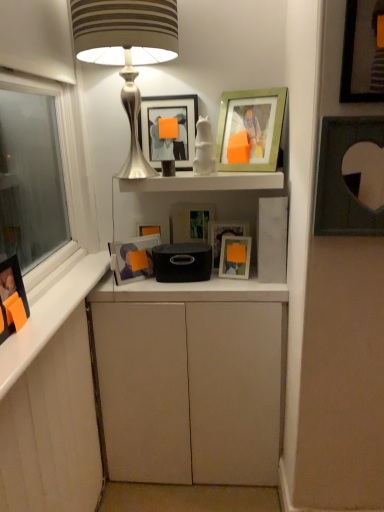
Question: Is matte white cabinet at center smaller than matte white picture frame at center, which is the fifth picture frame from left to right?

Choices:
 (A) no
 (B) yes

Answer: (A)

Question: From the image's perspective, is matte white cabinet at center beneath matte white picture frame at center, which is the fifth picture frame from left to right?

Choices:
 (A) no
 (B) yes

Answer: (B)

Question: Is matte white cabinet at center located outside matte white picture frame at center, which is the fifth picture frame from left to right?

Choices:
 (A) yes
 (B) no

Answer: (A)

Question: Is matte white cabinet at center far from matte white picture frame at center, which is the fifth picture frame from left to right?

Choices:
 (A) no
 (B) yes

Answer: (A)

Question: Does matte white cabinet at center have a lesser width compared to matte white picture frame at center, arranged as the fifth picture frame when viewed from the right?

Choices:
 (A) yes
 (B) no

Answer: (B)

Question: Is matte black picture frame at left, the ninth picture frame positioned from the right, spatially inside matte white picture frame at center, which is the fifth picture frame from left to right, or outside of it?

Choices:
 (A) outside
 (B) inside

Answer: (A)

Question: In the image, is matte black picture frame at left, which is counted as the first picture frame, starting from the left, positioned in front of or behind matte white picture frame at center, arranged as the fifth picture frame when viewed from the right?

Choices:
 (A) behind
 (B) front

Answer: (B)

Question: Based on their positions, is matte black picture frame at left, which is counted as the first picture frame, starting from the left, located to the left or right of matte white picture frame at center, arranged as the fifth picture frame when viewed from the right?

Choices:
 (A) left
 (B) right

Answer: (A)

Question: In terms of size, does matte black picture frame at left, the ninth picture frame positioned from the right, appear bigger or smaller than matte white picture frame at center, arranged as the fifth picture frame when viewed from the right?

Choices:
 (A) big
 (B) small

Answer: (A)

Question: Visually, is matte white picture frame at center, which is the fifth picture frame from left to right, positioned to the left or to the right of matte black picture frame at left, the ninth picture frame positioned from the right?

Choices:
 (A) left
 (B) right

Answer: (B)

Question: Relative to matte black picture frame at left, the ninth picture frame positioned from the right, is matte white picture frame at center, arranged as the fifth picture frame when viewed from the right, in front or behind?

Choices:
 (A) behind
 (B) front

Answer: (A)

Question: Is point (x=231, y=224) positioned closer to the camera than point (x=9, y=285)?

Choices:
 (A) closer
 (B) farther

Answer: (B)

Question: From a real-world perspective, relative to matte black picture frame at left, which is counted as the first picture frame, starting from the left, is matte white picture frame at center, which is the fifth picture frame from left to right, vertically above or below?

Choices:
 (A) below
 (B) above

Answer: (A)

Question: Relative to matte white cabinet at center, is matte black picture frame at upper center, the third picture frame when ordered from left to right, in front or behind?

Choices:
 (A) behind
 (B) front

Answer: (A)

Question: From a real-world perspective, is matte black picture frame at upper center, which appears as the 7th picture frame when viewed from the right, physically located above or below matte white cabinet at center?

Choices:
 (A) above
 (B) below

Answer: (A)